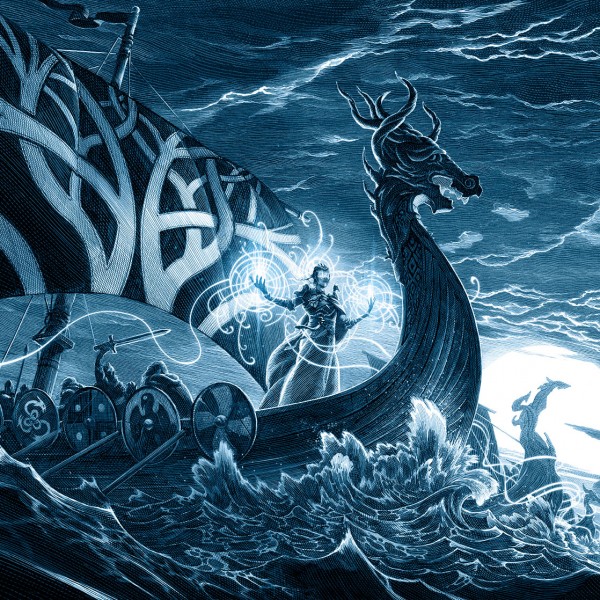
This screenshot has height=600, width=600. Find the location of `large bright light blue light`. large bright light blue light is located at coordinates (530, 381).